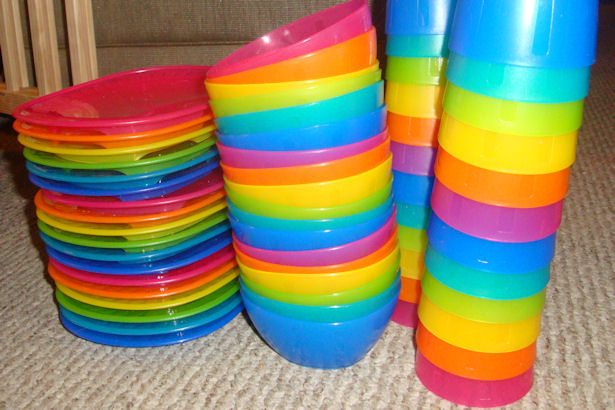
Locate an element on the screen. plates is located at coordinates (132, 164).